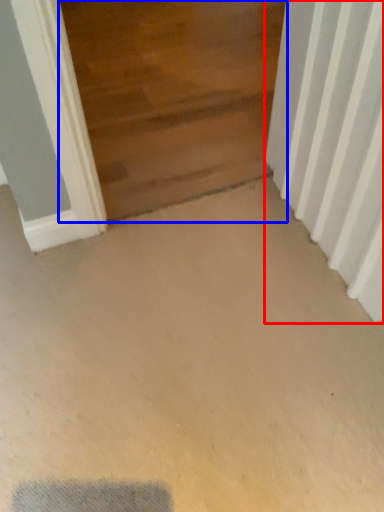
Question: Among these objects, which one is farthest to the camera, radiator (highlighted by a red box) or door (highlighted by a blue box)?

Choices:
 (A) radiator
 (B) door

Answer: (B)